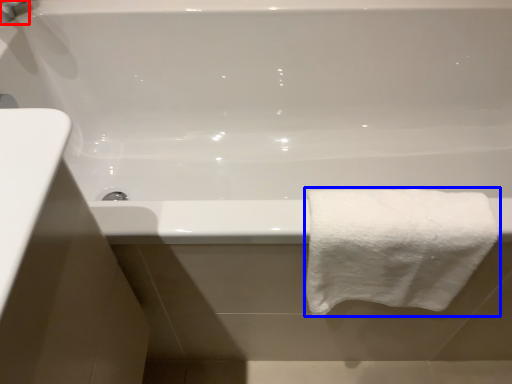
Question: Which of the following is the farthest to the observer, faucet (highlighted by a red box) or towel (highlighted by a blue box)?

Choices:
 (A) faucet
 (B) towel

Answer: (A)